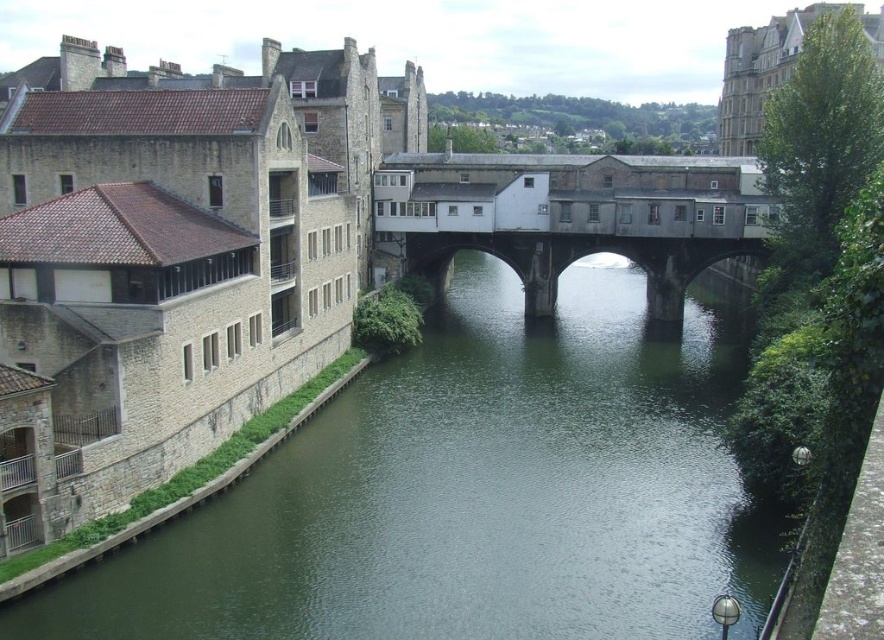
You are a tourist standing at the historic town and want to take a photo of the green stone river at center. Where should you position yourself to capture the river in the center of your photo?

The green stone river at center is located at point (x=476, y=492), so you should position yourself at that coordinate to capture it in the center of your photo.

You are standing at the camera position observing the scene. There is a point at coordinates point (x=520, y=525). Can you estimate how far this point is from your current position?

The point at point (x=520, y=525) is 44.02 meters away from the camera position.